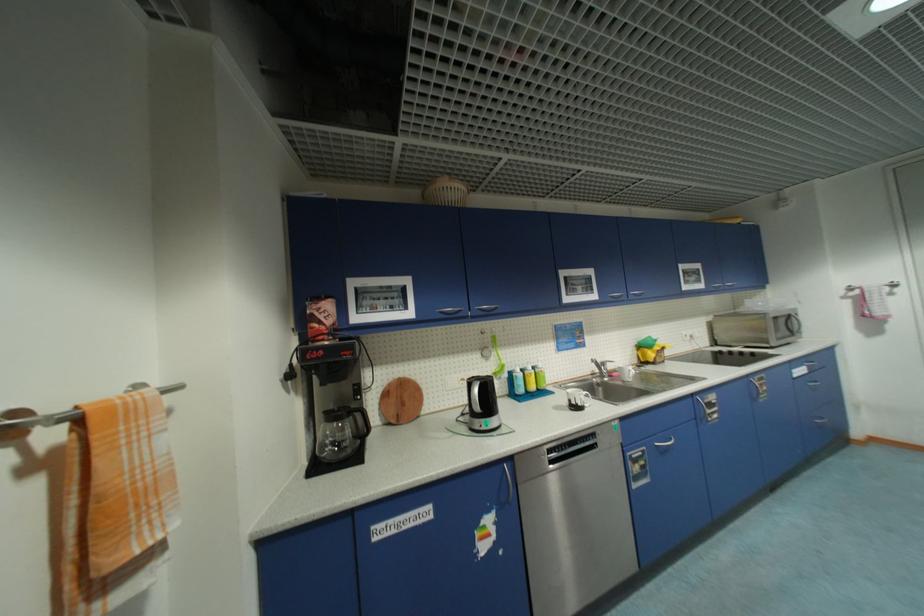
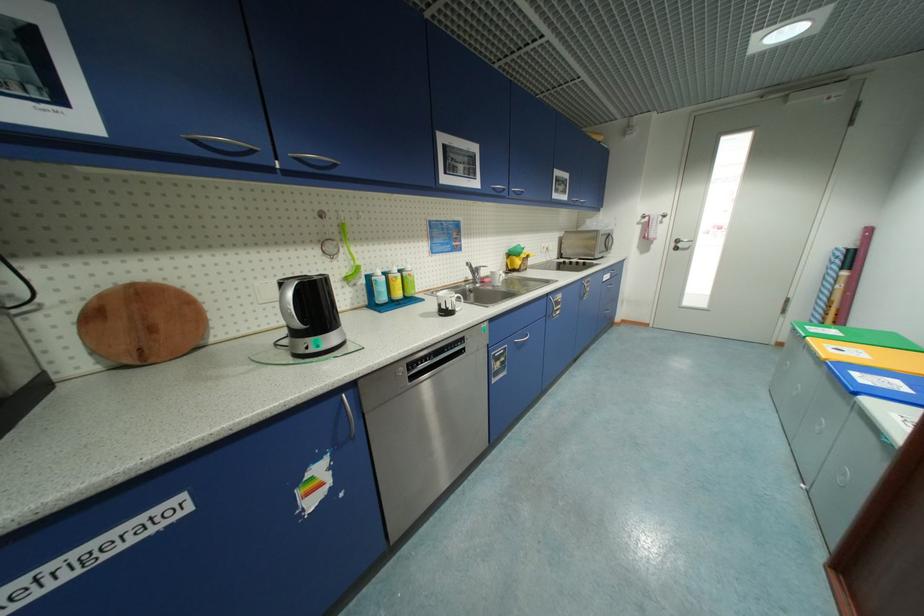
The point at (x=396, y=381) is marked in the first image. Where is the corresponding point in the second image?

(114, 286)